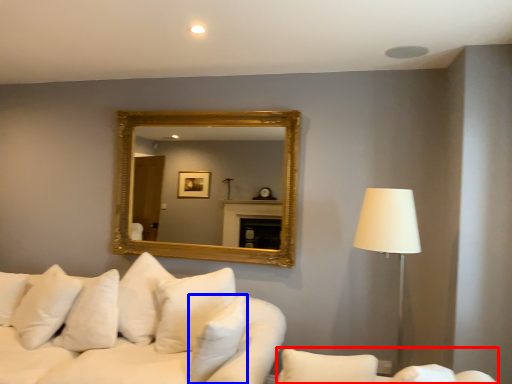
Question: Among these objects, which one is nearest to the camera, couch (highlighted by a red box) or pillow (highlighted by a blue box)?

Choices:
 (A) couch
 (B) pillow

Answer: (A)